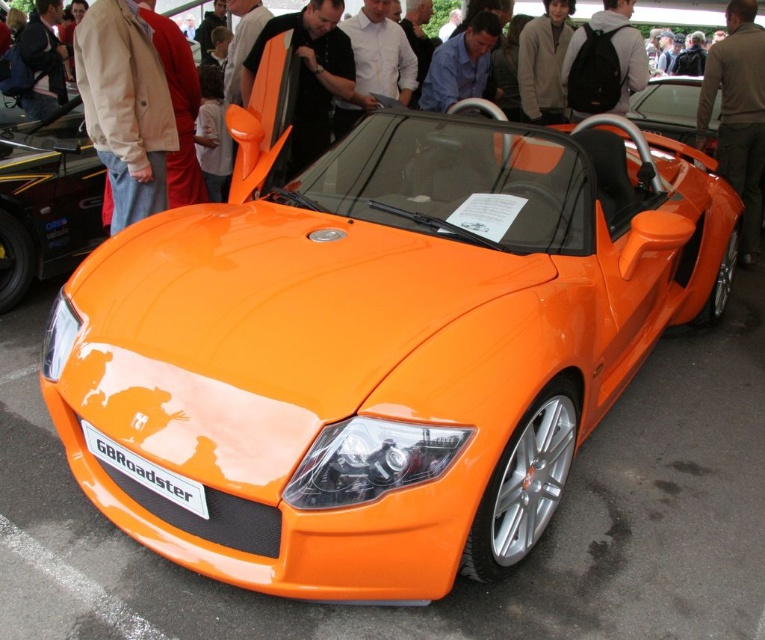
Is point (737, 74) positioned before point (620, 22)?

No, (737, 74) is behind (620, 22).

At what (x,y) coordinates should I click in order to perform the action: click on brown leather jacket at center. Please return your answer as a coordinate pair (x, y). Looking at the image, I should click on (737, 113).

Find the location of a particular element. The height and width of the screenshot is (640, 765). brown leather jacket at center is located at coordinates (737, 113).

Is point (623, 58) positioned before point (181, 481)?

No.

Between black backpack at upper center and matte black license plate at front, which one has less height?

matte black license plate at front

Which is in front, point (562, 74) or point (129, 477)?

Positioned in front is point (129, 477).

Identify the location of black backpack at upper center. (614, 52).

Is orange matte sports car at center below black backpack at upper center?

A: Yes.

Where is `orange matte sports car at center`? The image size is (765, 640). orange matte sports car at center is located at coordinates (46, 200).

I want to click on orange matte sports car at center, so click(46, 200).